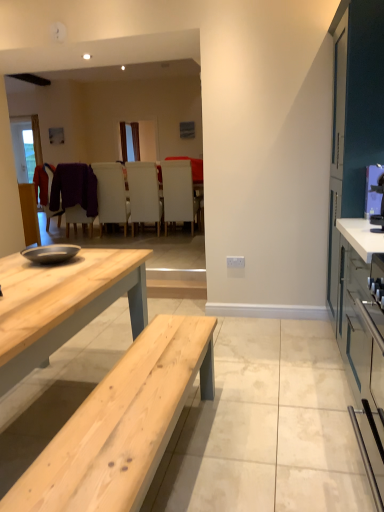
Question: Is white leather chair at center, positioned as the third chair in right-to-left order, not within metallic blue microwave at right?

Choices:
 (A) no
 (B) yes

Answer: (B)

Question: From the image's perspective, is white leather chair at center, positioned as the third chair in right-to-left order, on metallic blue microwave at right?

Choices:
 (A) no
 (B) yes

Answer: (B)

Question: From a real-world perspective, does white leather chair at center, positioned as the third chair in right-to-left order, stand above metallic blue microwave at right?

Choices:
 (A) yes
 (B) no

Answer: (B)

Question: From a real-world perspective, is white leather chair at center, positioned as the third chair in right-to-left order, positioned under metallic blue microwave at right based on gravity?

Choices:
 (A) no
 (B) yes

Answer: (B)

Question: From the image's perspective, would you say white leather chair at center, the second chair when ordered from left to right, is shown under metallic blue microwave at right?

Choices:
 (A) yes
 (B) no

Answer: (B)

Question: Considering the positions of metallic blue microwave at right and white matte chair at center, which is the first chair in right-to-left order, in the image, is metallic blue microwave at right bigger or smaller than white matte chair at center, which is the first chair in right-to-left order,?

Choices:
 (A) small
 (B) big

Answer: (A)

Question: From a real-world perspective, relative to white matte chair at center, which is the first chair in right-to-left order, is metallic blue microwave at right vertically above or below?

Choices:
 (A) above
 (B) below

Answer: (A)

Question: Based on their positions, is metallic blue microwave at right located to the left or right of white matte chair at center, which is the first chair in right-to-left order?

Choices:
 (A) left
 (B) right

Answer: (B)

Question: Is metallic blue microwave at right wider or thinner than white matte chair at center, which is the first chair in right-to-left order?

Choices:
 (A) wide
 (B) thin

Answer: (B)

Question: Choose the correct answer: Is white matte chair at center, arranged as the 2th chair when viewed from the right, inside matte black chair at center, which appears as the 4th chair when viewed from the right, or outside it?

Choices:
 (A) inside
 (B) outside

Answer: (B)

Question: In terms of width, does white matte chair at center, arranged as the 2th chair when viewed from the right, look wider or thinner when compared to matte black chair at center, the 1th chair in the left-to-right sequence?

Choices:
 (A) wide
 (B) thin

Answer: (A)

Question: From a real-world perspective, is white matte chair at center, arranged as the 2th chair when viewed from the right, above or below matte black chair at center, which appears as the 4th chair when viewed from the right?

Choices:
 (A) above
 (B) below

Answer: (B)

Question: Looking at the image, does white matte chair at center, arranged as the 2th chair when viewed from the right, seem bigger or smaller compared to matte black chair at center, the 1th chair in the left-to-right sequence?

Choices:
 (A) small
 (B) big

Answer: (B)

Question: From the image's perspective, is white leather chair at center, positioned as the third chair in right-to-left order, located above or below matte gray cabinet at right?

Choices:
 (A) above
 (B) below

Answer: (A)

Question: Based on their sizes in the image, would you say white leather chair at center, the second chair when ordered from left to right, is bigger or smaller than matte gray cabinet at right?

Choices:
 (A) small
 (B) big

Answer: (A)